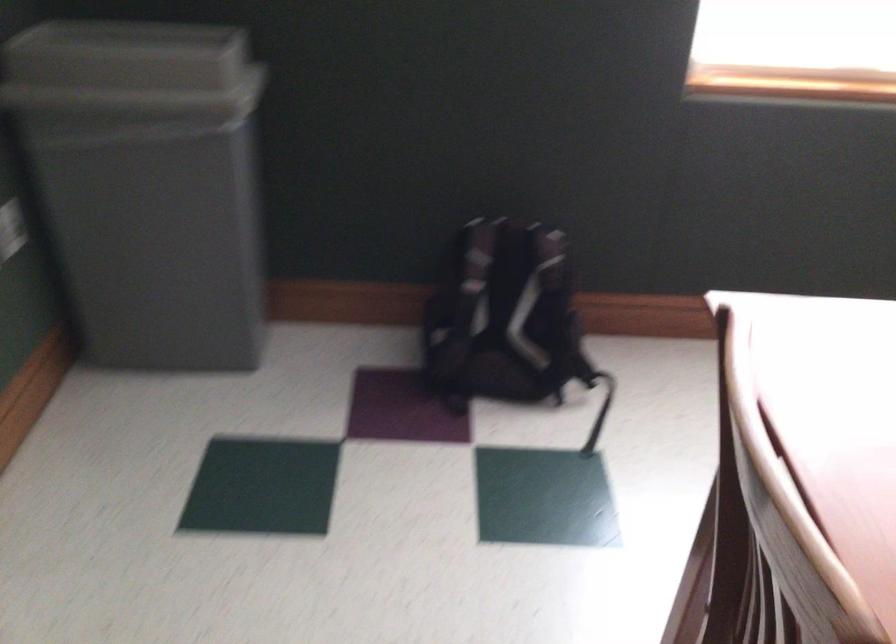
The height and width of the screenshot is (644, 896). In order to click on black backpack strap in this screenshot , I will do `click(598, 404)`.